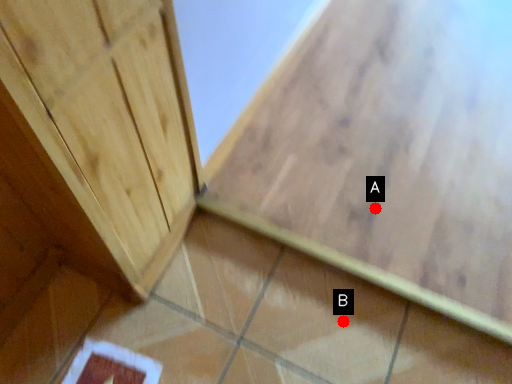
Question: Two points are circled on the image, labeled by A and B beside each circle. Among these points, which one is farthest from the camera?

Choices:
 (A) A is further
 (B) B is further

Answer: (A)